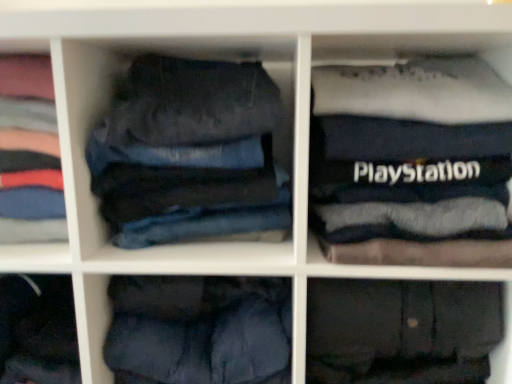
Question: From the image's perspective, is dark blue denim jeans at left, the 2th clothing from the right, located beneath dark blue cotton trousers at lower center, positioned as the 2th trousers in right-to-left order?

Choices:
 (A) no
 (B) yes

Answer: (A)

Question: Is dark blue denim jeans at left, which is the first clothing in left-to-right order, positioned beyond the bounds of dark blue cotton trousers at lower center, the second trousers positioned from the left?

Choices:
 (A) yes
 (B) no

Answer: (A)

Question: Would you say dark blue denim jeans at left, which is the first clothing in left-to-right order, contains dark blue cotton trousers at lower center, the second trousers positioned from the left?

Choices:
 (A) yes
 (B) no

Answer: (B)

Question: Is dark blue denim jeans at left, the 2th clothing from the right, in front of dark blue cotton trousers at lower center, the second trousers positioned from the left?

Choices:
 (A) no
 (B) yes

Answer: (A)

Question: From the image's perspective, is dark blue denim jeans at left, the 2th clothing from the right, on top of dark blue cotton trousers at lower center, the second trousers positioned from the left?

Choices:
 (A) yes
 (B) no

Answer: (A)

Question: Is dark blue denim jeans at left, the 2th clothing from the right, to the left or to the right of black fabric playstation case at upper right, which is the 1th clothing from right to left, in the image?

Choices:
 (A) right
 (B) left

Answer: (B)

Question: Is point click(42, 125) positioned closer to the camera than point click(445, 208)?

Choices:
 (A) farther
 (B) closer

Answer: (A)

Question: Is dark blue denim jeans at left, the 2th clothing from the right, wider or thinner than black fabric playstation case at upper right, which is the 1th clothing from right to left?

Choices:
 (A) thin
 (B) wide

Answer: (A)

Question: Considering their positions, is dark blue denim jeans at left, which is the first clothing in left-to-right order, located in front of or behind black fabric playstation case at upper right, which is the 1th clothing from right to left?

Choices:
 (A) behind
 (B) front

Answer: (A)

Question: Is point (181, 144) closer or farther from the camera than point (4, 178)?

Choices:
 (A) farther
 (B) closer

Answer: (B)

Question: From a real-world perspective, is denim jeans at center, the first trousers positioned from the left, physically located above or below dark blue denim jeans at left, the 2th clothing from the right?

Choices:
 (A) above
 (B) below

Answer: (A)

Question: From the image's perspective, is denim jeans at center, which is counted as the 3th trousers, starting from the right, located above or below dark blue denim jeans at left, which is the first clothing in left-to-right order?

Choices:
 (A) below
 (B) above

Answer: (A)

Question: Considering the positions of denim jeans at center, the first trousers positioned from the left, and dark blue denim jeans at left, the 2th clothing from the right, in the image, is denim jeans at center, the first trousers positioned from the left, wider or thinner than dark blue denim jeans at left, the 2th clothing from the right,?

Choices:
 (A) wide
 (B) thin

Answer: (A)

Question: Considering the positions of dark blue denim jeans at left, the 2th clothing from the right, and denim jeans at center, which is counted as the 3th trousers, starting from the right, in the image, is dark blue denim jeans at left, the 2th clothing from the right, wider or thinner than denim jeans at center, which is counted as the 3th trousers, starting from the right,?

Choices:
 (A) thin
 (B) wide

Answer: (A)

Question: Is dark blue denim jeans at left, which is the first clothing in left-to-right order, to the left or to the right of denim jeans at center, which is counted as the 3th trousers, starting from the right, in the image?

Choices:
 (A) right
 (B) left

Answer: (B)